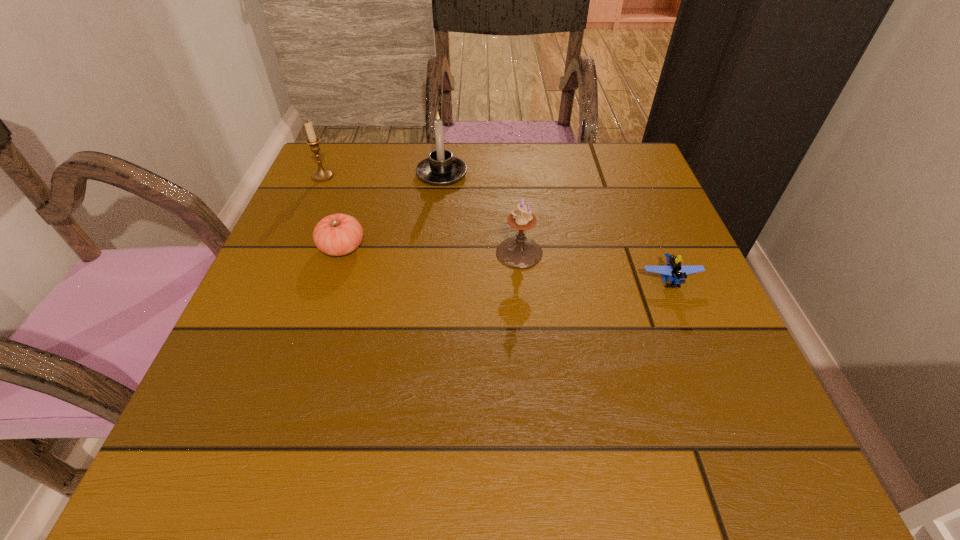
Image resolution: width=960 pixels, height=540 pixels. In order to click on free location at the far right corner in this screenshot , I will do `click(602, 184)`.

The height and width of the screenshot is (540, 960). I want to click on free area in between the rightmost object and the fourth object from left to right, so click(595, 267).

The image size is (960, 540). In order to click on free space between the second object from right to left and the second candle holder from right to left in this screenshot , I will do `click(481, 213)`.

Locate an element on the screen. unoccupied position between the second candle holder from right to left and the Lego is located at coordinates (556, 227).

Locate an element on the screen. Image resolution: width=960 pixels, height=540 pixels. unoccupied area between the nearest candle holder and the tomato is located at coordinates (431, 250).

Where is `vacant region between the rightmost object and the third object from left to right`? vacant region between the rightmost object and the third object from left to right is located at coordinates (556, 227).

Find the location of a particular element. Image resolution: width=960 pixels, height=540 pixels. free area in between the fourth object from right to left and the nearest candle holder is located at coordinates click(x=431, y=250).

Locate an element on the screen. Image resolution: width=960 pixels, height=540 pixels. unoccupied position between the nearest candle holder and the rightmost object is located at coordinates (595, 267).

This screenshot has height=540, width=960. Find the location of `vacant area between the leftmost candle holder and the second object from right to left`. vacant area between the leftmost candle holder and the second object from right to left is located at coordinates (x=421, y=214).

The image size is (960, 540). I want to click on vacant region between the second object from left to right and the third object from right to left, so click(x=392, y=211).